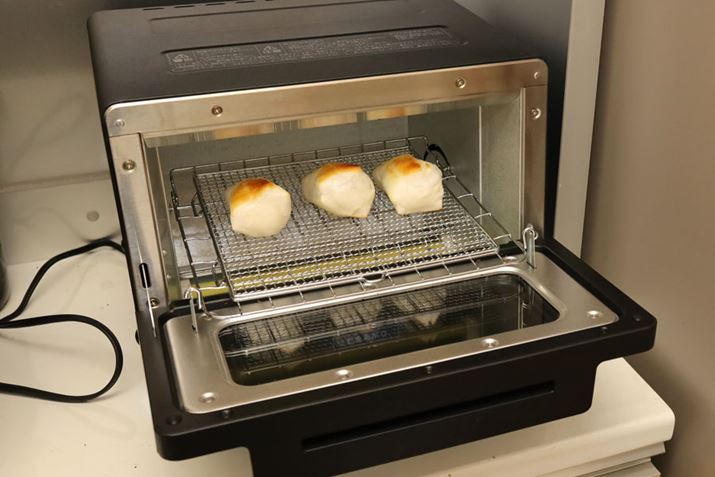
Locate an element on the screen. screws is located at coordinates (220, 114), (129, 160), (157, 303), (207, 395), (531, 115), (463, 81).